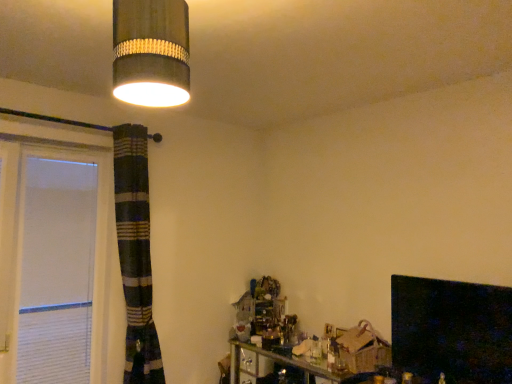
Question: Is matte gray cylindrical lampshade at upper left positioned with its back to black glossy fireplace at lower right?

Choices:
 (A) no
 (B) yes

Answer: (A)

Question: From the image's perspective, is matte gray cylindrical lampshade at upper left below black glossy fireplace at lower right?

Choices:
 (A) no
 (B) yes

Answer: (A)

Question: Does matte gray cylindrical lampshade at upper left lie behind black glossy fireplace at lower right?

Choices:
 (A) yes
 (B) no

Answer: (B)

Question: Is matte gray cylindrical lampshade at upper left smaller than black glossy fireplace at lower right?

Choices:
 (A) yes
 (B) no

Answer: (A)

Question: Are matte gray cylindrical lampshade at upper left and black glossy fireplace at lower right far apart?

Choices:
 (A) yes
 (B) no

Answer: (A)

Question: From a real-world perspective, is matte gray cylindrical lampshade at upper left positioned under black glossy fireplace at lower right based on gravity?

Choices:
 (A) no
 (B) yes

Answer: (A)

Question: From a real-world perspective, is black glossy fireplace at lower right on top of matte gray cylindrical lampshade at upper left?

Choices:
 (A) yes
 (B) no

Answer: (B)

Question: Does black glossy fireplace at lower right appear on the right side of matte gray cylindrical lampshade at upper left?

Choices:
 (A) no
 (B) yes

Answer: (B)

Question: Are black glossy fireplace at lower right and matte gray cylindrical lampshade at upper left making contact?

Choices:
 (A) no
 (B) yes

Answer: (A)

Question: Can you confirm if black glossy fireplace at lower right is thinner than matte gray cylindrical lampshade at upper left?

Choices:
 (A) no
 (B) yes

Answer: (A)

Question: From the image's perspective, is black glossy fireplace at lower right over matte gray cylindrical lampshade at upper left?

Choices:
 (A) no
 (B) yes

Answer: (A)

Question: Is black glossy fireplace at lower right further to the viewer compared to matte gray cylindrical lampshade at upper left?

Choices:
 (A) no
 (B) yes

Answer: (B)

Question: Looking at the image, does black glossy fireplace at lower right seem bigger or smaller compared to matte gray cylindrical lampshade at upper left?

Choices:
 (A) big
 (B) small

Answer: (A)